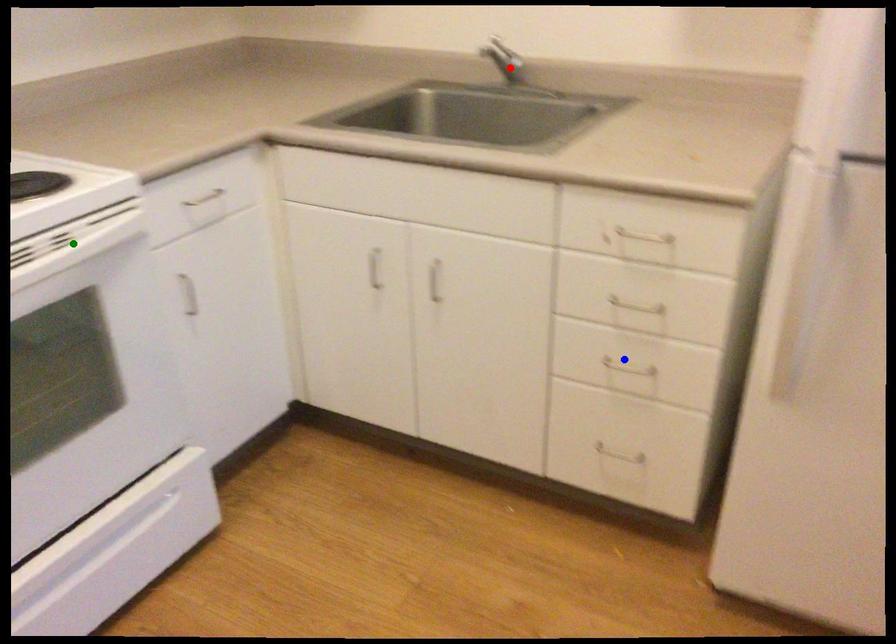
Order these from farthest to nearest:
A) green point
B) blue point
C) red point

red point, blue point, green point